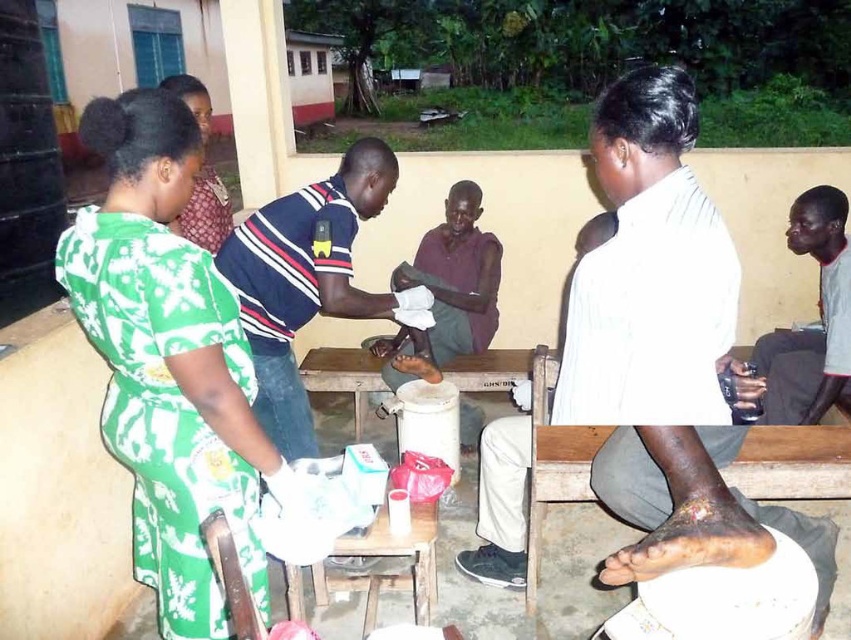
Question: Is striped cotton shirt at center to the right of wooden table at center from the viewer's perspective?

Choices:
 (A) yes
 (B) no

Answer: (A)

Question: Can you confirm if wooden table at center is positioned above green floral dress at upper left?

Choices:
 (A) no
 (B) yes

Answer: (A)

Question: Is green printed dress at left wider than dark gray fabric shirt at right?

Choices:
 (A) no
 (B) yes

Answer: (B)

Question: Which object appears closest to the camera in this image?

Choices:
 (A) green floral dress at upper left
 (B) wooden table at center

Answer: (A)

Question: Which of the following is the farthest from the observer?

Choices:
 (A) green floral dress at upper left
 (B) white shirt at upper right
 (C) green printed dress at left

Answer: (A)

Question: Which point is closer to the camera?

Choices:
 (A) (363, 406)
 (B) (192, 502)

Answer: (B)